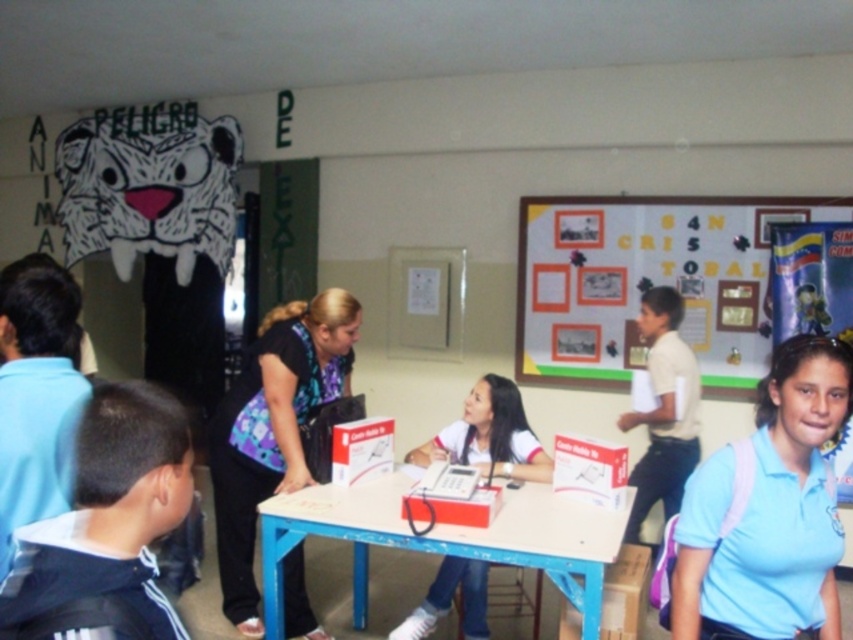
Based on the scene description, what are the coordinates of the blue printed blouse at center?

The blue printed blouse at center is located at coordinates point (273, 428).

You are a student in the classroom and you want to hand in your homework to the teacher. The teacher is wearing a blue printed blouse at center. You are wearing a light blue shirt at lower right. If you stand next to the teacher, will your shirt be shorter than hers?

The light blue shirt at lower right is shorter than blue printed blouse at center, so yes, your shirt will be shorter than the teacher when you stand next to her.